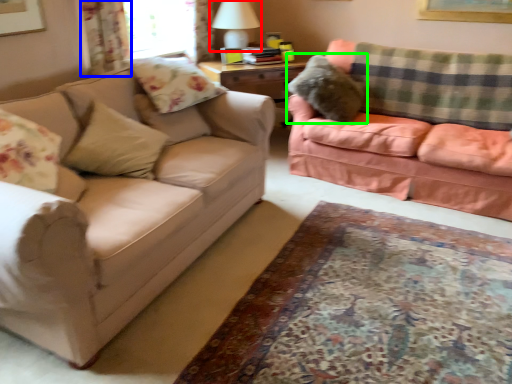
Question: Which is farther away from table lamp (highlighted by a red box)? curtain (highlighted by a blue box) or pillow (highlighted by a green box)?

Choices:
 (A) curtain
 (B) pillow

Answer: (A)